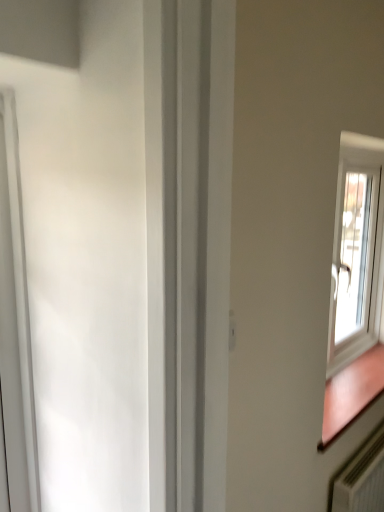
Describe the element at coordinates (356, 249) in the screenshot. Image resolution: width=384 pixels, height=512 pixels. I see `white plastic window at right` at that location.

Find the location of a particular element. The height and width of the screenshot is (512, 384). white plastic window at right is located at coordinates (356, 249).

Where is `white plastic window at right`? This screenshot has height=512, width=384. white plastic window at right is located at coordinates (356, 249).